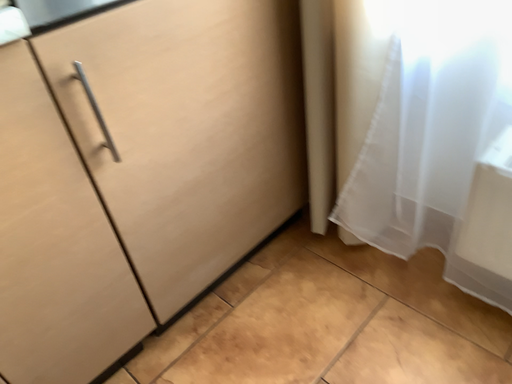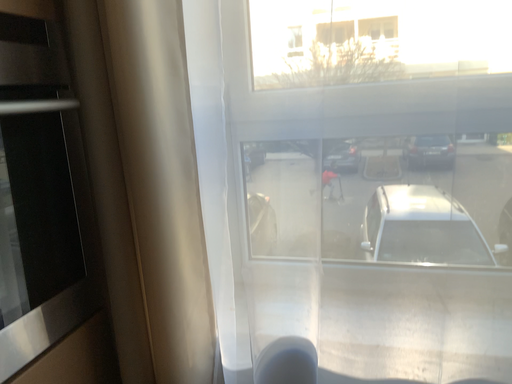
Question: Which way did the camera rotate in the video?

Choices:
 (A) rotated right
 (B) rotated left

Answer: (A)